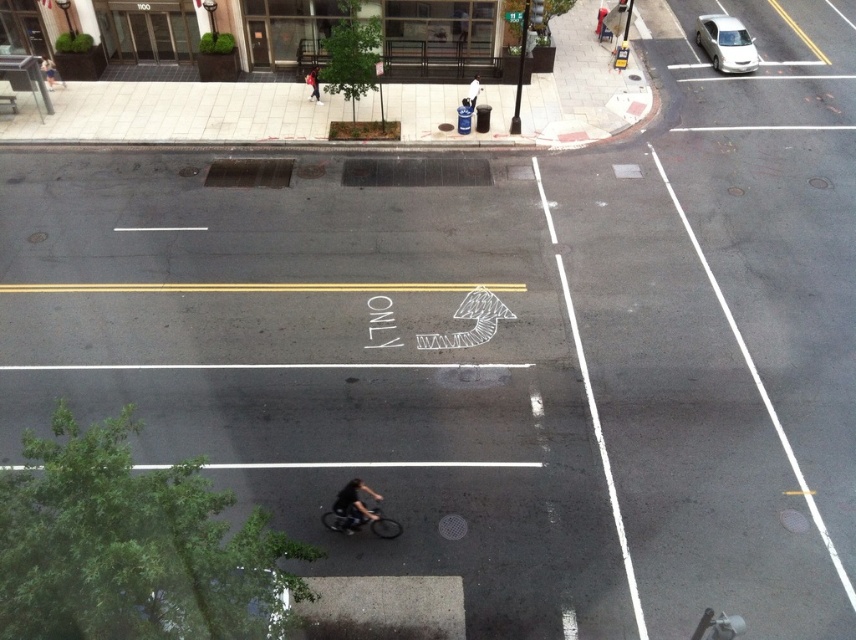
You are a delivery driver who needs to park your silver metallic car at upper right near the black matte bicycle at lower center. Given the distance between them, can you safely maneuver your car to park within 5 meters of the bicycle without obstructing traffic?

The silver metallic car at upper right and black matte bicycle at lower center are 21.82 meters apart. To park within 5 meters of the bicycle, the car would need to maneuver a distance of at least 16.82 meters. This distance may be challenging in an urban setting with traffic, so it is advisable to look for a closer parking spot or follow traffic rules to ensure safety and avoid obstruction.

You are a delivery person who needs to place a small package between the black matte bicycle at lower center and the dark blue jeans at center. Which object should you place the package closer to to ensure it doesn

The black matte bicycle at lower center is larger in size than the dark blue jeans at center, so placing the package closer to the bicycle would provide more space for the package to fit comfortably.

From the picture: You are a delivery person needing to reach the dark blue jeans at center. The black matte bicycle at lower center is blocking your path. Can you walk around it without crossing the road?

The black matte bicycle at lower center is below dark blue jeans at center, so you can walk around it by moving to the right or left along the sidewalk without crossing the road.